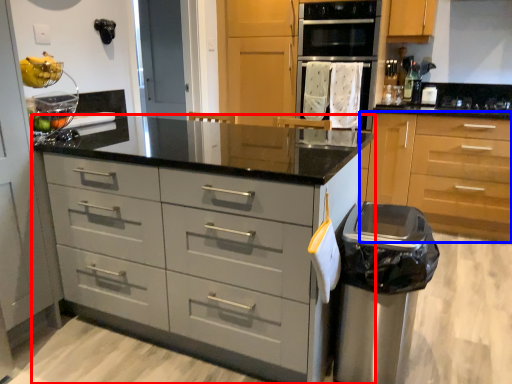
Question: Which object is closer to the camera taking this photo, chest of drawers (highlighted by a red box) or cabinetry (highlighted by a blue box)?

Choices:
 (A) chest of drawers
 (B) cabinetry

Answer: (A)